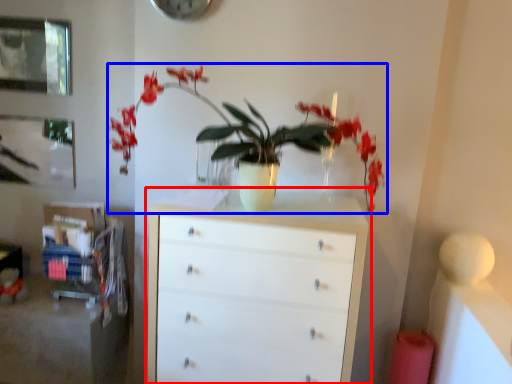
Question: Among these objects, which one is farthest to the camera, chest of drawers (highlighted by a red box) or houseplant (highlighted by a blue box)?

Choices:
 (A) chest of drawers
 (B) houseplant

Answer: (A)